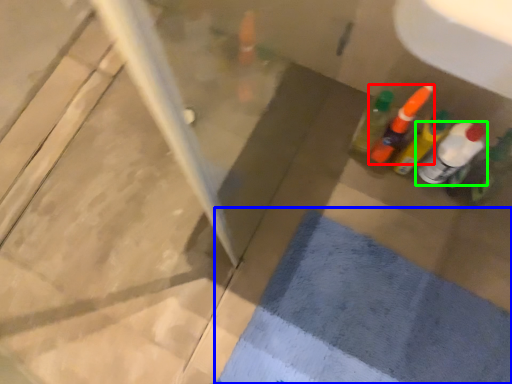
Question: Considering the real-world distances, which object is farthest from bottle (highlighted by a red box)? bath mat (highlighted by a blue box) or bottle (highlighted by a green box)?

Choices:
 (A) bath mat
 (B) bottle

Answer: (A)